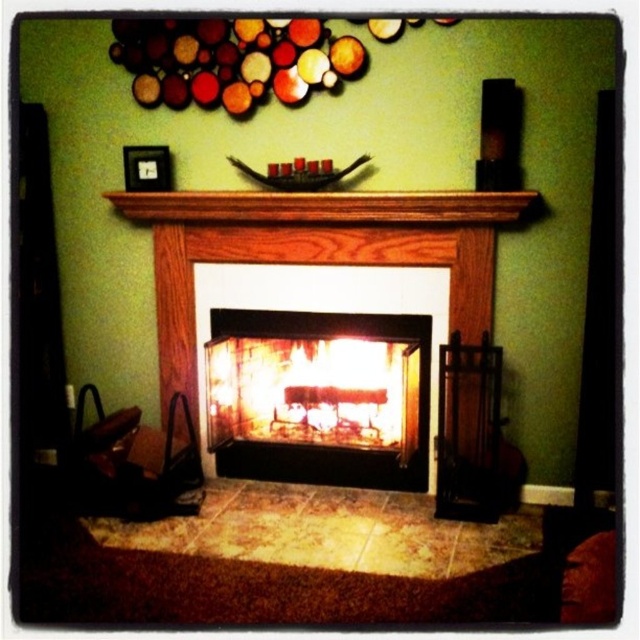
Is wooden fireplace at center smaller than wooden mantel at center?

Incorrect, wooden fireplace at center is not smaller in size than wooden mantel at center.

Which is more to the left, wooden fireplace at center or wooden mantel at center?

From the viewer's perspective, wooden mantel at center appears more on the left side.

Which is behind, point (193, 344) or point (188, 200)?

Point (193, 344)

Locate an element on the screen. Image resolution: width=640 pixels, height=640 pixels. wooden fireplace at center is located at coordinates (314, 250).

Looking at this image, between flaming wood fire at center and wooden mantel at center, which one is positioned higher?

wooden mantel at center is higher up.

Is flaming wood fire at center closer to the viewer compared to wooden mantel at center?

No, flaming wood fire at center is behind wooden mantel at center.

Locate an element on the screen. flaming wood fire at center is located at coordinates (312, 392).

Does wooden fireplace at center appear on the left side of flaming wood fire at center?

In fact, wooden fireplace at center is to the right of flaming wood fire at center.

Consider the image. Does wooden fireplace at center appear on the right side of flaming wood fire at center?

Indeed, wooden fireplace at center is positioned on the right side of flaming wood fire at center.

Who is more forward, [314,228] or [280,365]?

Positioned in front is point [314,228].

Locate an element on the screen. The width and height of the screenshot is (640, 640). wooden fireplace at center is located at coordinates (314, 250).